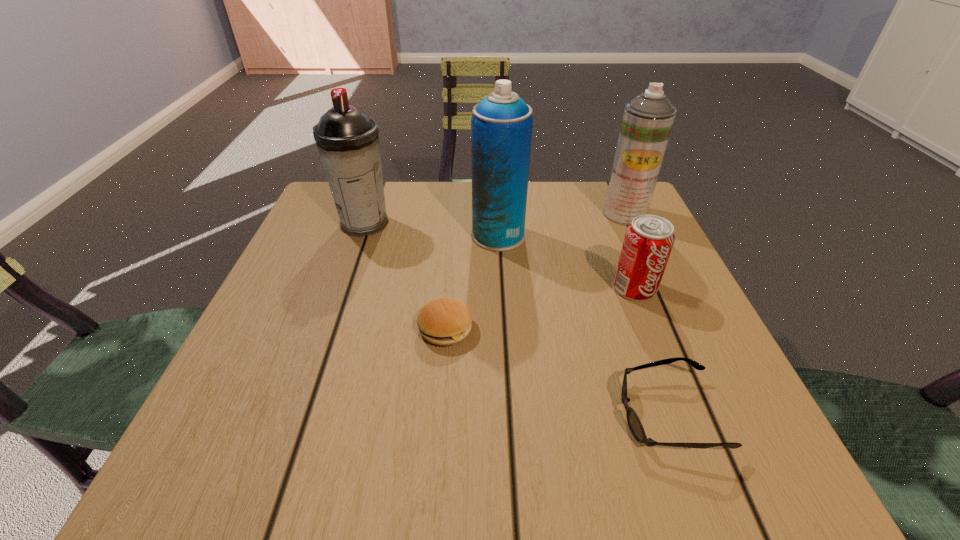
At what (x,y) coordinates should I click in order to perform the action: click on free space between the nearest object and the fifth farthest object. Please return your answer as a coordinate pair (x, y). Looking at the image, I should click on (557, 372).

You are a GUI agent. You are given a task and a screenshot of the screen. Output one action in this format:
    pyautogui.click(x=<x>, y=<y>)
    Task: Click on the free space between the second aerosol can from right to left and the sunglasses
    Image resolution: width=960 pixels, height=540 pixels.
    Given the screenshot: What is the action you would take?
    pyautogui.click(x=584, y=325)

What are the coordinates of `free spot between the second nearest object and the nearest object` in the screenshot? It's located at (557, 372).

Locate an element on the screen. This screenshot has width=960, height=540. free space between the nearest object and the leftmost aerosol can is located at coordinates tap(516, 319).

The image size is (960, 540). What are the coordinates of `empty space between the second nearest object and the leftmost object` in the screenshot? It's located at (405, 276).

The width and height of the screenshot is (960, 540). I want to click on object that stands as the fourth closest to the second aerosol can from left to right, so click(647, 121).

Image resolution: width=960 pixels, height=540 pixels. I want to click on the closest object to the sunglasses, so click(x=649, y=239).

Locate which aerosol can is the second closest to the patty. Please provide its 2D coordinates. Your answer should be formatted as a tuple, i.e. [(x, y)], where the tuple contains the x and y coordinates of a point satisfying the conditions above.

[(347, 139)]

Point out which aerosol can is positioned as the second nearest to the third shortest object. Please provide its 2D coordinates. Your answer should be formatted as a tuple, i.e. [(x, y)], where the tuple contains the x and y coordinates of a point satisfying the conditions above.

[(647, 121)]

Identify the location of vacant position in the image that satisfies the following two spatial constraints: 1. on the back side of the second nearest object; 2. on the right side of the rightmost aerosol can. The width and height of the screenshot is (960, 540). (455, 213).